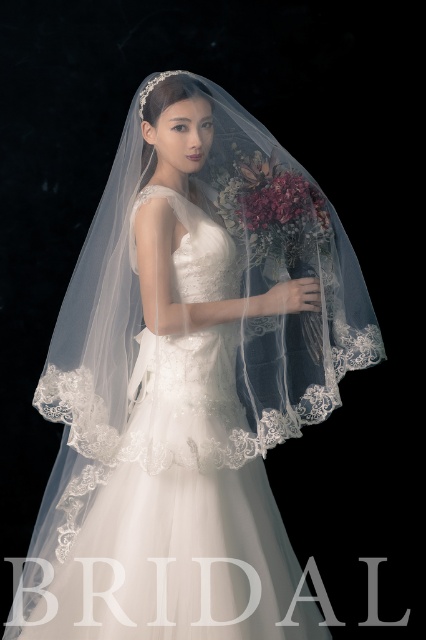
Question: Based on their relative distances, which object is farther from the deep burgundy silk bouquet at center?

Choices:
 (A) velvet floral bouquet at center
 (B) white lace dress at center

Answer: (B)

Question: Does velvet floral bouquet at center appear under deep burgundy silk bouquet at center?

Choices:
 (A) no
 (B) yes

Answer: (B)

Question: Which is nearer to the velvet floral bouquet at center?

Choices:
 (A) white lace dress at center
 (B) deep burgundy silk bouquet at center

Answer: (B)

Question: Which object is closer to the camera taking this photo?

Choices:
 (A) deep burgundy silk bouquet at center
 (B) white lace dress at center

Answer: (B)

Question: Is white lace dress at center to the right of velvet floral bouquet at center from the viewer's perspective?

Choices:
 (A) no
 (B) yes

Answer: (A)

Question: Is white lace dress at center bigger than deep burgundy silk bouquet at center?

Choices:
 (A) yes
 (B) no

Answer: (A)